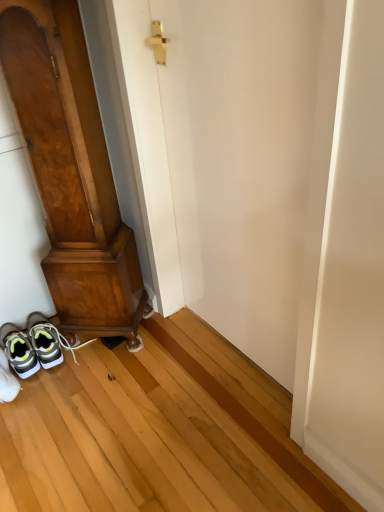
Question: Is point [8, 333] positioned closer to the camera than point [1, 367]?

Choices:
 (A) farther
 (B) closer

Answer: (A)

Question: From a real-world perspective, relative to white mesh sneakers at lower left, marked as the 1th footwear in a front-to-back arrangement, is white matte sneakers at lower left, which ranks as the 2th footwear in front-to-back order, vertically above or below?

Choices:
 (A) below
 (B) above

Answer: (A)

Question: Which is farther from the wooden door at left, the first door from the left?

Choices:
 (A) white smooth door at center, which ranks as the 1th door in right-to-left order
 (B) white matte sneakers at lower left, which is counted as the 1th footwear, starting from the back
 (C) white mesh sneakers at lower left, marked as the 1th footwear in a front-to-back arrangement

Answer: (C)

Question: Considering the real-world distances, which object is farthest from the wooden door at left, the second door in the right-to-left sequence?

Choices:
 (A) white smooth door at center, which ranks as the 2th door in left-to-right order
 (B) white matte sneakers at lower left, which ranks as the 2th footwear in front-to-back order
 (C) white mesh sneakers at lower left, marked as the 2th footwear in a back-to-front arrangement

Answer: (C)